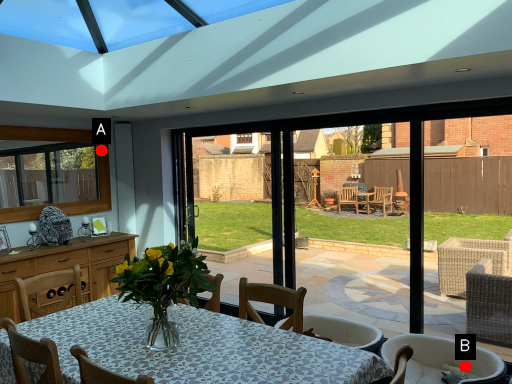
Question: Two points are circled on the image, labeled by A and B beside each circle. Which of the following is the farthest from the observer?

Choices:
 (A) A is further
 (B) B is further

Answer: (A)